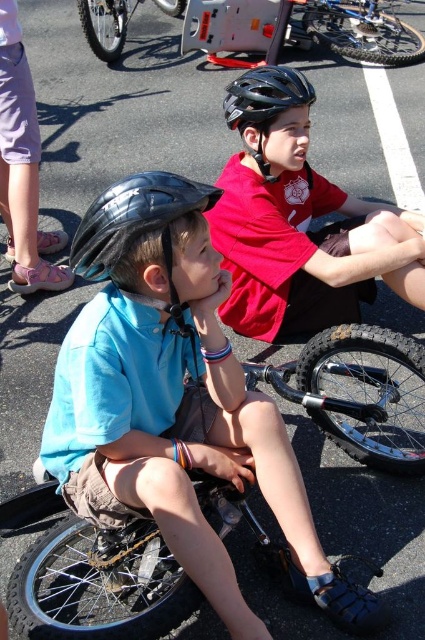
Between matte black helmet at center and black matte helmet at left, which one has more height?

With more height is matte black helmet at center.

In the scene shown: Between matte black helmet at center and black matte helmet at left, which one has less height?

Standing shorter between the two is black matte helmet at left.

This screenshot has height=640, width=425. Describe the element at coordinates (299, 221) in the screenshot. I see `matte black helmet at center` at that location.

What are the coordinates of `matte black helmet at center` in the screenshot? It's located at (299, 221).

In order to click on pink fabric shorts at lower left in this screenshot , I will do `click(22, 168)`.

Who is taller, pink fabric shorts at lower left or black matte helmet at upper center?

Standing taller between the two is pink fabric shorts at lower left.

Which is behind, point (28, 198) or point (261, 88)?

Point (28, 198)

In order to click on pink fabric shorts at lower left in this screenshot , I will do `click(22, 168)`.

Between matte blue helmet at left and silver metallic bicycle wheel at upper left, which one has more height?

matte blue helmet at left is taller.

Who is shorter, matte blue helmet at left or silver metallic bicycle wheel at upper left?

With less height is silver metallic bicycle wheel at upper left.

Locate an element on the screen. matte blue helmet at left is located at coordinates (175, 401).

Where is `matte blue helmet at left`? The height and width of the screenshot is (640, 425). matte blue helmet at left is located at coordinates [175, 401].